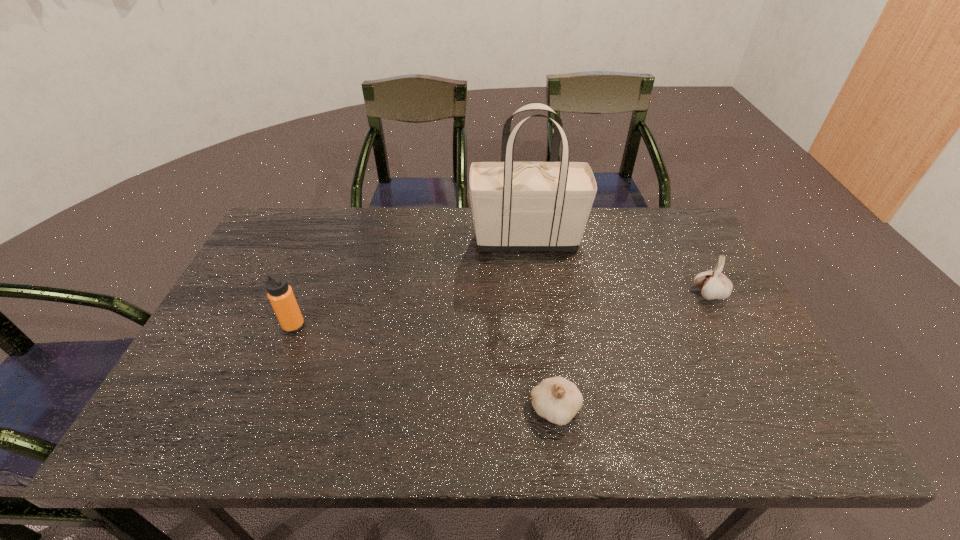
This screenshot has width=960, height=540. In the image, there is a desktop. In order to click on vacant space at the near left corner in this screenshot , I will do `click(211, 435)`.

Where is `vacant space at the far right corner of the desktop`? The image size is (960, 540). vacant space at the far right corner of the desktop is located at coordinates click(649, 221).

Image resolution: width=960 pixels, height=540 pixels. In order to click on unoccupied position between the farthest object and the left garlic in this screenshot , I will do `click(540, 324)`.

At what (x,y) coordinates should I click in order to perform the action: click on vacant space that is in between the second tallest object and the farther garlic. Please return your answer as a coordinate pair (x, y). The width and height of the screenshot is (960, 540). Looking at the image, I should click on (502, 309).

Find the location of a particular element. empty space between the nearest object and the shopping bag is located at coordinates (540, 324).

The image size is (960, 540). I want to click on blank region between the third shortest object and the right garlic, so click(x=502, y=309).

Image resolution: width=960 pixels, height=540 pixels. What are the coordinates of `vacant region between the second farthest object and the second tallest object` in the screenshot? It's located at (502, 309).

Identify the location of free space that is in between the third nearest object and the tallest object. (618, 266).

The image size is (960, 540). Identify the location of empty space between the rightmost object and the shorter garlic. (633, 352).

The height and width of the screenshot is (540, 960). Identify the location of vacant space that's between the shortest object and the second farthest object. (633, 352).